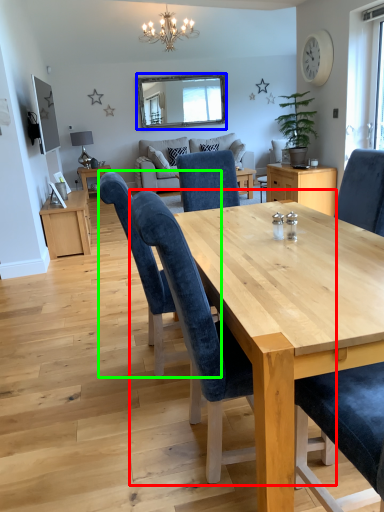
Question: Which object is the closest to the chair (highlighted by a red box)? Choose among these: mirror (highlighted by a blue box) or chair (highlighted by a green box).

Choices:
 (A) mirror
 (B) chair

Answer: (B)